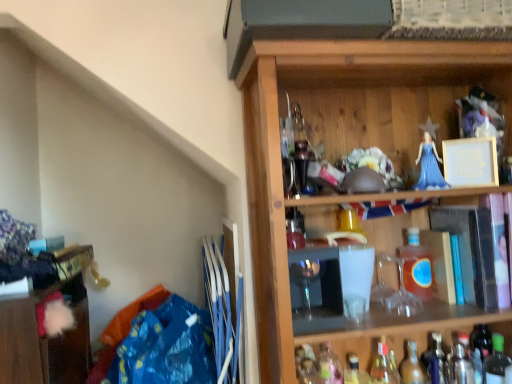
Question: From a real-world perspective, relative to translucent glass bottle at lower right, marked as the 3th bottle in a right-to-left arrangement, is wooden cabinet at lower left vertically above or below?

Choices:
 (A) below
 (B) above

Answer: (B)

Question: Would you say wooden cabinet at lower left is to the left or to the right of translucent glass bottle at lower right, marked as the 3th bottle in a right-to-left arrangement, in the picture?

Choices:
 (A) left
 (B) right

Answer: (A)

Question: Estimate the real-world distances between objects in this image. Which object is farther from the wooden shelf at upper right?

Choices:
 (A) translucent amber glass bottle at center-right, arranged as the 4th bottle when viewed from the left
 (B) translucent glass bottle at lower center, the first bottle positioned from the left
 (C) wooden cabinet at lower left
 (D) green glass bottle at lower right, placed as the eighth bottle when sorted from left to right
 (E) translucent glass bottle at lower right, which is the third bottle from left to right

Answer: (C)

Question: Estimate the real-world distances between objects in this image. Which object is closer to the translucent amber glass bottle at center-right, arranged as the 4th bottle when viewed from the left?

Choices:
 (A) wooden shelf at upper right
 (B) translucent glass bottle at lower right, marked as the sixth bottle in a right-to-left arrangement
 (C) translucent glass bottle at lower right, which ranks as the 2th bottle in left-to-right order
 (D) translucent glass bottle at lower right, the fourth bottle in the right-to-left sequence
 (E) metallic silver shaker at lower right, which appears as the second bottle when viewed from the right

Answer: (D)